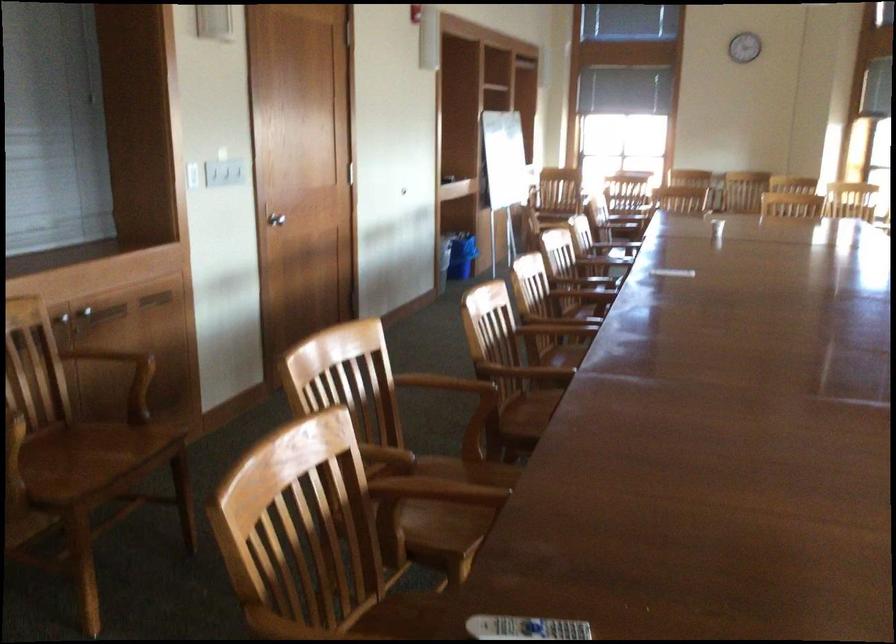
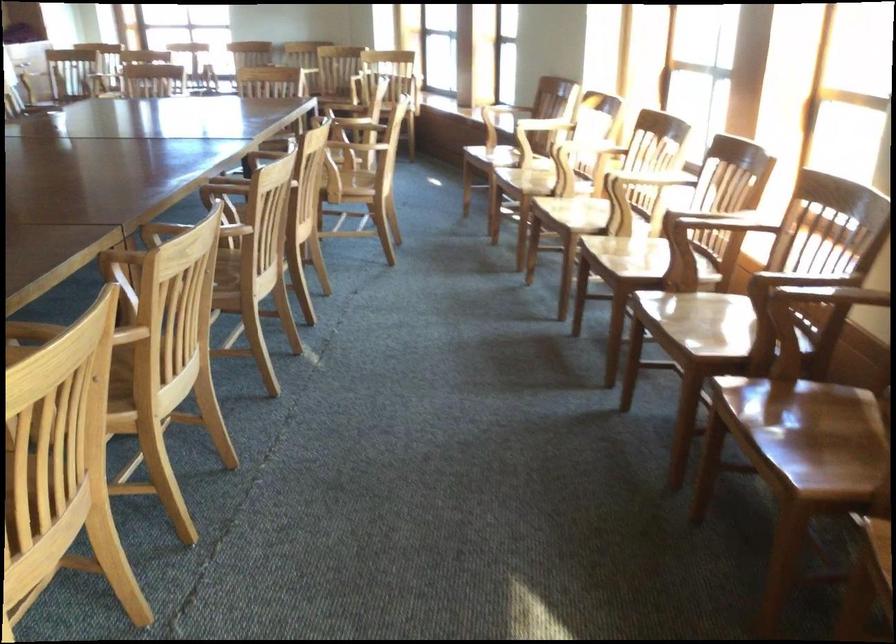
Question: What movement of the cameraman would produce the second image?

Choices:
 (A) Left
 (B) Right
 (C) Forward
 (D) Backward

Answer: (B)